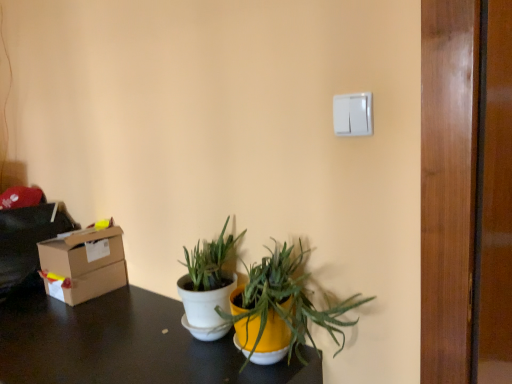
Question: From the image's perspective, is white matte pot at center, the first houseplant when ordered from left to right, located above or below white plastic light switch at upper right?

Choices:
 (A) below
 (B) above

Answer: (A)

Question: Is white matte pot at center, the first houseplant when ordered from left to right, bigger or smaller than white plastic light switch at upper right?

Choices:
 (A) small
 (B) big

Answer: (B)

Question: Considering the real-world distances, which object is closest to the white matte pot at center, the first houseplant when ordered from left to right?

Choices:
 (A) cardboard box at left
 (B) white matte pot at center, arranged as the 1th houseplant when viewed from the right
 (C) white plastic light switch at upper right
 (D) matte black desk at lower center

Answer: (B)

Question: Which is farther from the white matte pot at center, arranged as the 1th houseplant when viewed from the right?

Choices:
 (A) cardboard box at left
 (B) white matte pot at center, the first houseplant when ordered from left to right
 (C) matte black desk at lower center
 (D) white plastic light switch at upper right

Answer: (A)